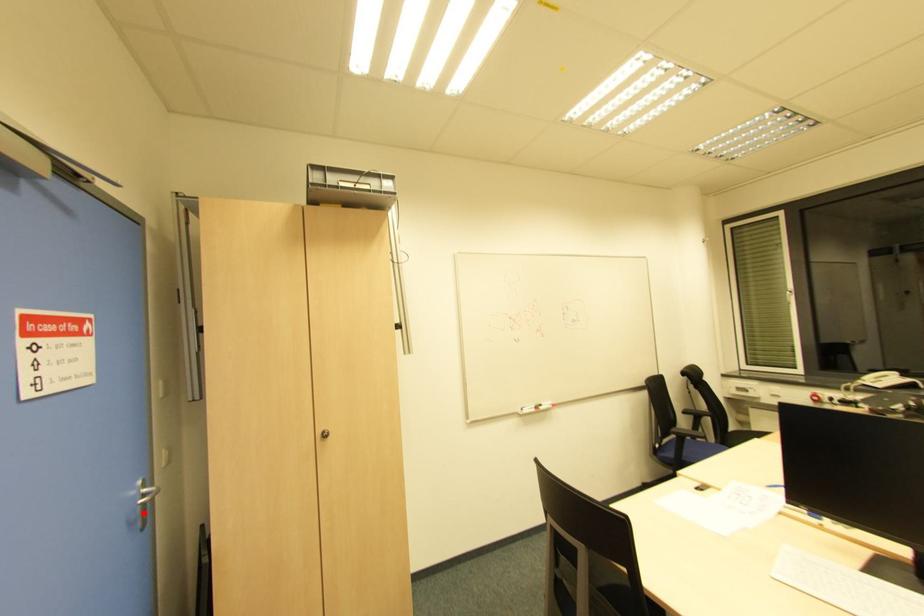
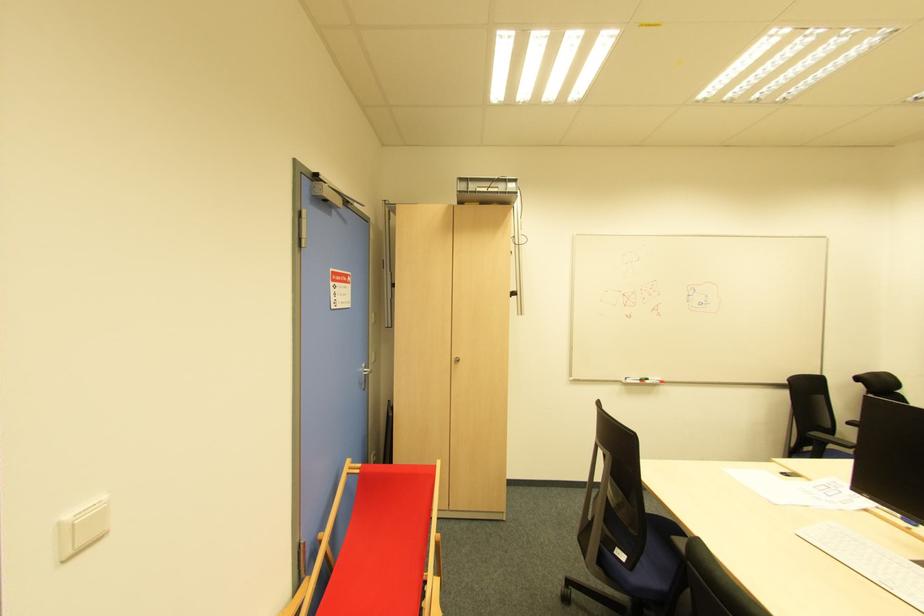
Find the pixel in the second image that matches the highlighted location in the first image.

(366, 382)